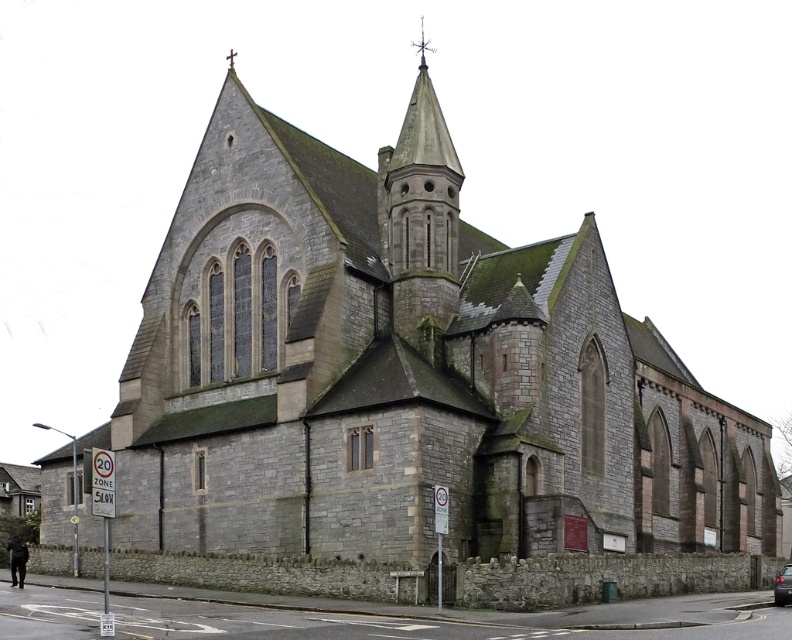
You are standing in front of the Gothic church and want to take a photo. You notice two points marked in the scene. The first point is at coordinates point (398, 237), and the second is at point (787, 570). Which of these points is closer to your camera when taking the photo?

Point (398, 237) is further to the camera than point (787, 570), so the second point is closer to the camera.

Looking at this image, you are a photographer positioned at the lower right corner of the scene. You want to capture a photo of the dark gray stone spire at center without any obstructions. Is the metallic silver car at lower right blocking your view of the spire?

The dark gray stone spire at center is above the metallic silver car at lower right, so the car is not blocking the view of the spire. You can take the photo without any obstruction.